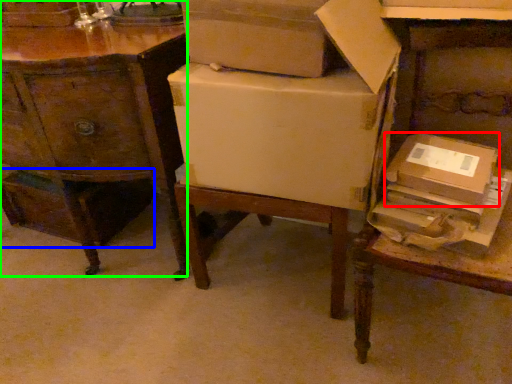
Question: Based on their relative distances, which object is farther from cardboard box (highlighted by a red box)? Choose from storage box (highlighted by a blue box) and desk (highlighted by a green box).

Choices:
 (A) storage box
 (B) desk

Answer: (A)